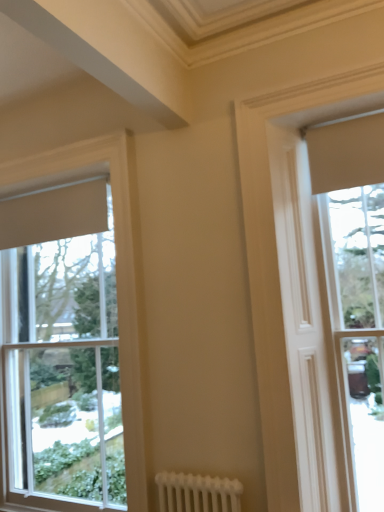
In order to face matte beige curtain at right, the 1th window viewed from the right, should I rotate leftwards or rightwards?

Rotate your view right by about 21.846°.

Where is `matte beige window at upper right, the second window when ordered from left to right`? The width and height of the screenshot is (384, 512). matte beige window at upper right, the second window when ordered from left to right is located at coordinates (292, 298).

Measure the distance between point (x=143, y=382) and camera.

The distance of point (x=143, y=382) from camera is 7.28 feet.

Find the location of a particular element. matte beige curtain at right, the 1th window viewed from the right is located at coordinates (355, 286).

Considering their positions, is white wood window at left, marked as the 3th window in a right-to-left arrangement, located in front of or behind matte beige window at upper right, the second window when ordered from left to right?

Clearly, white wood window at left, marked as the 3th window in a right-to-left arrangement, is behind matte beige window at upper right, the second window when ordered from left to right.

Is white wood window at left, which ranks as the 1th window in left-to-right order, turned away from matte beige window at upper right, which is the 2th window from right to left?

No, matte beige window at upper right, which is the 2th window from right to left, is not at the back of white wood window at left, which ranks as the 1th window in left-to-right order.

Which of these two, white wood window at left, marked as the 3th window in a right-to-left arrangement, or matte beige window at upper right, which is the 2th window from right to left, is thinner?

matte beige window at upper right, which is the 2th window from right to left, is thinner.

Considering the positions of objects white wood window at left, marked as the 3th window in a right-to-left arrangement, and matte beige window at upper right, the second window when ordered from left to right, in the image provided, who is more to the right, white wood window at left, marked as the 3th window in a right-to-left arrangement, or matte beige window at upper right, the second window when ordered from left to right,?

From the viewer's perspective, matte beige window at upper right, the second window when ordered from left to right, appears more on the right side.

From the image's perspective, is matte beige window at upper right, the second window when ordered from left to right, above white wood window at left, which ranks as the 1th window in left-to-right order?

Yes, from the image's perspective, matte beige window at upper right, the second window when ordered from left to right, is on top of white wood window at left, which ranks as the 1th window in left-to-right order.

From a real-world perspective, is matte beige window at upper right, which is the 2th window from right to left, positioned over white wood window at left, which ranks as the 1th window in left-to-right order, based on gravity?

Indeed, from a real-world perspective, matte beige window at upper right, which is the 2th window from right to left, stands above white wood window at left, which ranks as the 1th window in left-to-right order.

From the picture: Could you measure the distance between matte beige window at upper right, which is the 2th window from right to left, and white wood window at left, marked as the 3th window in a right-to-left arrangement?

matte beige window at upper right, which is the 2th window from right to left, is 31.96 inches from white wood window at left, marked as the 3th window in a right-to-left arrangement.

Is matte beige window at upper right, the second window when ordered from left to right, not close to white wood window at left, marked as the 3th window in a right-to-left arrangement?

No, matte beige window at upper right, the second window when ordered from left to right, is not far away from white wood window at left, marked as the 3th window in a right-to-left arrangement.

Considering the sizes of objects white wood window at left, marked as the 3th window in a right-to-left arrangement, and matte beige curtain at right, the 1th window viewed from the right, in the image provided, who is thinner, white wood window at left, marked as the 3th window in a right-to-left arrangement, or matte beige curtain at right, the 1th window viewed from the right,?

white wood window at left, marked as the 3th window in a right-to-left arrangement.

Who is bigger, white wood window at left, which ranks as the 1th window in left-to-right order, or matte beige curtain at right, placed as the 3th window when sorted from left to right?

With larger size is white wood window at left, which ranks as the 1th window in left-to-right order.

Find the location of a particular element. The width and height of the screenshot is (384, 512). window lying below the matte beige curtain at right, placed as the 3th window when sorted from left to right (from the image's perspective) is located at coordinates (117, 280).

Is matte beige window at upper right, which is the 2th window from right to left, facing towards matte beige curtain at right, placed as the 3th window when sorted from left to right?

Yes.

From the image's perspective, is matte beige window at upper right, which is the 2th window from right to left, on top of matte beige curtain at right, placed as the 3th window when sorted from left to right?

Correct, matte beige window at upper right, which is the 2th window from right to left, appears higher than matte beige curtain at right, placed as the 3th window when sorted from left to right, in the image.

From a real-world perspective, which object rests below the other?

From a 3D spatial view, matte beige curtain at right, placed as the 3th window when sorted from left to right, is below.

Does point (257, 232) lie in front of point (343, 191)?

That is True.

Is matte beige curtain at right, placed as the 3th window when sorted from left to right, looking in the opposite direction of matte beige window at upper right, the second window when ordered from left to right?

Yes, matte beige window at upper right, the second window when ordered from left to right, is at the back of matte beige curtain at right, placed as the 3th window when sorted from left to right.

Considering the sizes of objects matte beige curtain at right, the 1th window viewed from the right, and matte beige window at upper right, the second window when ordered from left to right, in the image provided, who is taller, matte beige curtain at right, the 1th window viewed from the right, or matte beige window at upper right, the second window when ordered from left to right,?

matte beige window at upper right, the second window when ordered from left to right, is taller.

Which is more to the left, matte beige curtain at right, the 1th window viewed from the right, or matte beige window at upper right, which is the 2th window from right to left?

matte beige window at upper right, which is the 2th window from right to left.

How far apart are matte beige curtain at right, the 1th window viewed from the right, and white wood window at left, which ranks as the 1th window in left-to-right order?

matte beige curtain at right, the 1th window viewed from the right, and white wood window at left, which ranks as the 1th window in left-to-right order, are 1.11 meters apart.

Is matte beige curtain at right, the 1th window viewed from the right, inside the boundaries of white wood window at left, marked as the 3th window in a right-to-left arrangement, or outside?

matte beige curtain at right, the 1th window viewed from the right, cannot be found inside white wood window at left, marked as the 3th window in a right-to-left arrangement.

Is matte beige curtain at right, the 1th window viewed from the right, wider than white wood window at left, marked as the 3th window in a right-to-left arrangement?

Yes.

Is matte beige curtain at right, placed as the 3th window when sorted from left to right, touching white wood window at left, which ranks as the 1th window in left-to-right order?

matte beige curtain at right, placed as the 3th window when sorted from left to right, and white wood window at left, which ranks as the 1th window in left-to-right order, are not in contact.

The width and height of the screenshot is (384, 512). In order to click on window on the left side of matte beige window at upper right, the second window when ordered from left to right in this screenshot , I will do `click(117, 280)`.

Identify the location of the 1st window to the right of the white wood window at left, marked as the 3th window in a right-to-left arrangement, starting your count from the anchor. (292, 298).

From the image, which object appears to be nearer to matte beige window at upper right, the second window when ordered from left to right, matte beige curtain at right, placed as the 3th window when sorted from left to right, or white wood window at left, marked as the 3th window in a right-to-left arrangement?

matte beige curtain at right, placed as the 3th window when sorted from left to right.

When comparing their distances from matte beige window at upper right, the second window when ordered from left to right, does white wood window at left, marked as the 3th window in a right-to-left arrangement, or matte beige curtain at right, placed as the 3th window when sorted from left to right, seem closer?

matte beige curtain at right, placed as the 3th window when sorted from left to right, is positioned closer to the anchor matte beige window at upper right, the second window when ordered from left to right.

From the picture: Considering their positions, is matte beige window at upper right, the second window when ordered from left to right, positioned closer to matte beige curtain at right, placed as the 3th window when sorted from left to right, than white wood window at left, marked as the 3th window in a right-to-left arrangement?

matte beige window at upper right, the second window when ordered from left to right.

Looking at the image, which one is located closer to white wood window at left, marked as the 3th window in a right-to-left arrangement, matte beige window at upper right, which is the 2th window from right to left, or matte beige curtain at right, placed as the 3th window when sorted from left to right?

matte beige window at upper right, which is the 2th window from right to left, lies closer to white wood window at left, marked as the 3th window in a right-to-left arrangement, than the other object.

Looking at the image, which one is located closer to matte beige curtain at right, placed as the 3th window when sorted from left to right, white wood window at left, marked as the 3th window in a right-to-left arrangement, or matte beige window at upper right, which is the 2th window from right to left?

matte beige window at upper right, which is the 2th window from right to left, is closer to matte beige curtain at right, placed as the 3th window when sorted from left to right.

Considering their positions, is matte beige curtain at right, placed as the 3th window when sorted from left to right, positioned further to white wood window at left, which ranks as the 1th window in left-to-right order, than matte beige window at upper right, the second window when ordered from left to right?

matte beige curtain at right, placed as the 3th window when sorted from left to right.

I want to click on window between white wood window at left, which ranks as the 1th window in left-to-right order, and matte beige curtain at right, placed as the 3th window when sorted from left to right, from left to right, so click(x=292, y=298).